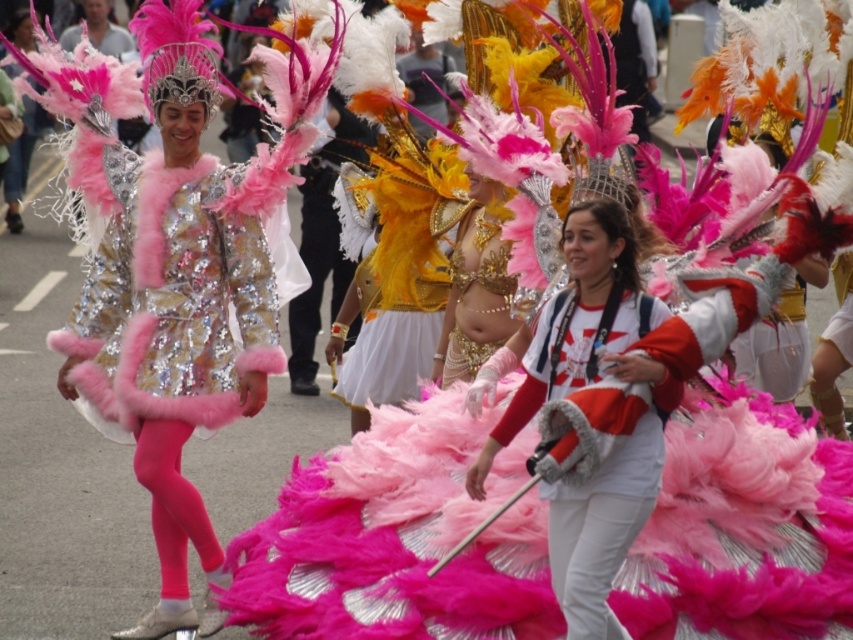
Between matte silver helmet at upper center and white cotton scarf at center, which one appears on the right side from the viewer's perspective?

From the viewer's perspective, white cotton scarf at center appears more on the right side.

Does matte silver helmet at upper center come behind white cotton scarf at center?

That is True.

You are a GUI agent. You are given a task and a screenshot of the screen. Output one action in this format:
    pyautogui.click(x=<x>, y=<y>)
    Task: Click on the matte silver helmet at upper center
    The height and width of the screenshot is (640, 853).
    Given the screenshot: What is the action you would take?
    pyautogui.click(x=177, y=262)